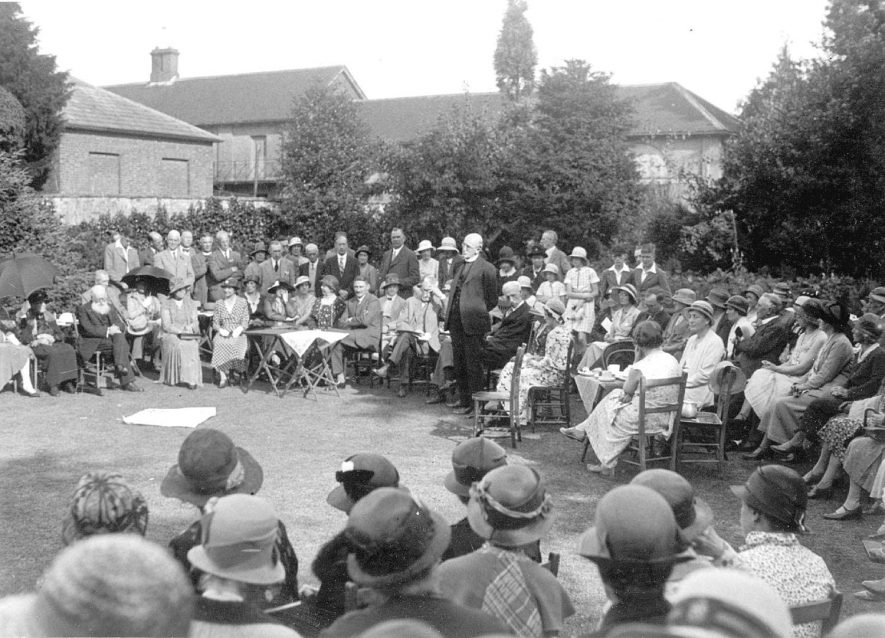
This screenshot has width=885, height=638. What are the coordinates of `table` in the screenshot? It's located at (267, 337), (324, 360).